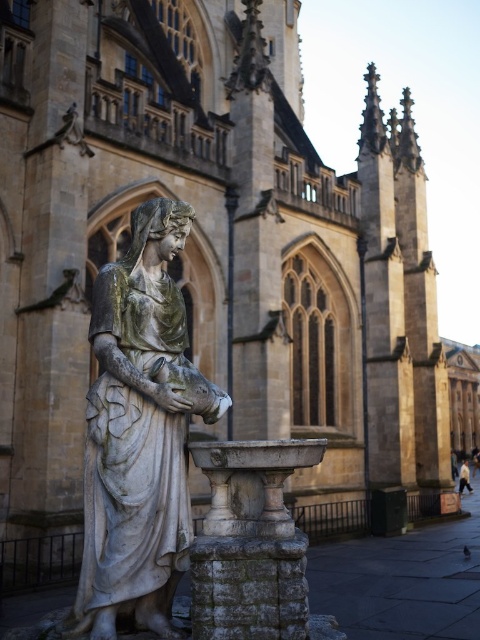
Who is positioned more to the right, stone statue at center or white cotton shirt at center?

white cotton shirt at center is more to the right.

Which of these two, stone statue at center or white cotton shirt at center, stands taller?

Standing taller between the two is stone statue at center.

Is point (128, 269) closer to viewer compared to point (468, 477)?

Yes, point (128, 269) is in front of point (468, 477).

The image size is (480, 640). Find the location of `stone statue at center`. stone statue at center is located at coordinates (135, 435).